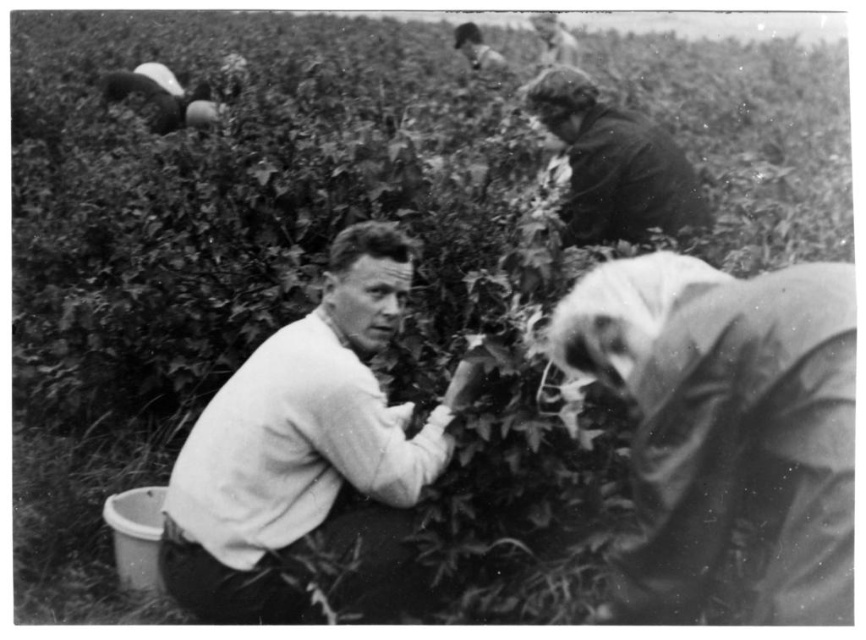
Looking at the scene, which object is smaller in size between the dark brown fabric at upper right and the smooth skin face at upper center?

The dark brown fabric at upper right is smaller in size compared to the smooth skin face at upper center.

Consider the image. Looking at the photograph, can you determine which object is positioned higher between the smooth fabric shirt at upper center and the smooth skin face at upper center?

The smooth fabric shirt at upper center is located above the smooth skin face at upper center.